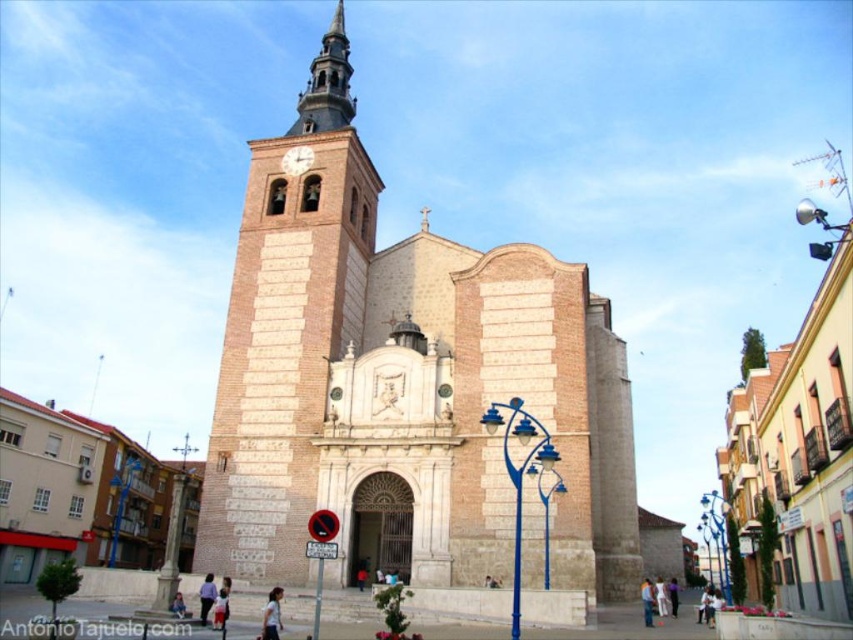
Does brown stone clock tower at center have a lesser height compared to light blue fabric shirt at lower center?

Incorrect, brown stone clock tower at center's height does not fall short of light blue fabric shirt at lower center's.

Is brown stone clock tower at center thinner than light blue fabric shirt at lower center?

Incorrect, brown stone clock tower at center's width is not less than light blue fabric shirt at lower center's.

Describe the element at coordinates (288, 328) in the screenshot. Image resolution: width=853 pixels, height=640 pixels. I see `brown stone clock tower at center` at that location.

Locate an element on the screen. This screenshot has height=640, width=853. brown stone clock tower at center is located at coordinates (288, 328).

Which is behind, point (343, 422) or point (271, 630)?

The point (343, 422) is more distant.

Is beige stone church at center bigger than light blue fabric shirt at lower center?

Indeed, beige stone church at center has a larger size compared to light blue fabric shirt at lower center.

At what (x,y) coordinates should I click in order to perform the action: click on beige stone church at center. Please return your answer as a coordinate pair (x, y). The height and width of the screenshot is (640, 853). Looking at the image, I should click on 402,384.

Does beige stone church at center have a lesser width compared to denim jacket at lower center?

Incorrect, beige stone church at center's width is not less than denim jacket at lower center's.

Is beige stone church at center below denim jacket at lower center?

Incorrect, beige stone church at center is not positioned below denim jacket at lower center.

Describe the element at coordinates (402, 384) in the screenshot. Image resolution: width=853 pixels, height=640 pixels. I see `beige stone church at center` at that location.

At what (x,y) coordinates should I click in order to perform the action: click on beige stone church at center. Please return your answer as a coordinate pair (x, y). The image size is (853, 640). Looking at the image, I should click on (402, 384).